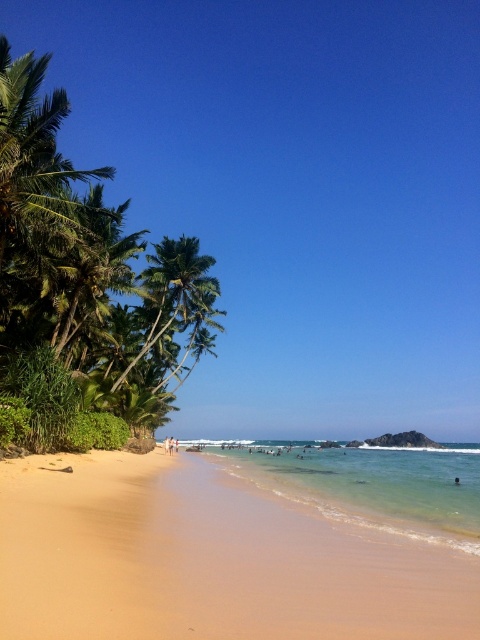
You are standing at the center of the image and want to walk to the sandy beach at lower left. In which direction should you move?

Since the sandy beach at lower left is located at point (210, 560), you should move towards the lower left direction to reach it.

You are standing at the point with coordinates point (142, 369) and want to walk to the point with coordinates point (424, 620). Which direction should you face to walk towards your destination?

You should face towards the direction of the palm trees cluster on the left side of the image because point (424, 620) is in front of point (142, 369), meaning it is closer to the palm trees cluster.

You are standing on the beach and want to take a photo of the clear water at beach center without the green leafy palm tree at left blocking the view. Is this possible?

The clear water at beach center is behind the green leafy palm tree at left, so if you are standing on the beach, the palm tree would block the view of the water behind it. To capture the clear water at beach center without obstruction, you would need to move around the palm tree cluster on the left side of the image to get a clear shot.